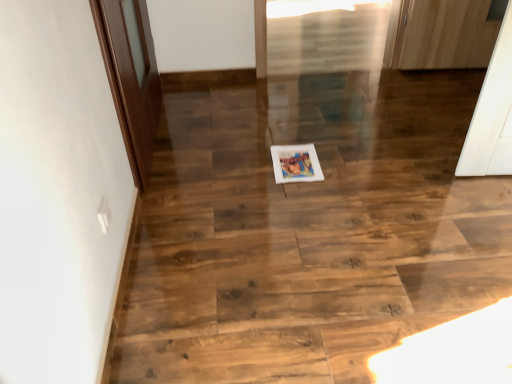
In order to click on brown wooden door at left in this screenshot , I will do `click(131, 77)`.

This screenshot has height=384, width=512. Describe the element at coordinates (131, 77) in the screenshot. I see `brown wooden door at left` at that location.

This screenshot has width=512, height=384. What are the coordinates of `matte paper postcard at center` in the screenshot? It's located at (296, 163).

This screenshot has width=512, height=384. I want to click on brown wooden door at left, so click(x=131, y=77).

Measure the distance from brown wooden door at left to matte paper postcard at center.

A distance of 27.57 inches exists between brown wooden door at left and matte paper postcard at center.

From the image's perspective, which is below, brown wooden door at left or matte paper postcard at center?

matte paper postcard at center, from the image's perspective.

From the picture: Is brown wooden door at left aimed at matte paper postcard at center?

Yes, brown wooden door at left is turned towards matte paper postcard at center.

Considering the positions of point (144, 84) and point (308, 169), is point (144, 84) closer or farther from the camera than point (308, 169)?

Clearly, point (144, 84) is more distant from the camera than point (308, 169).

Image resolution: width=512 pixels, height=384 pixels. I want to click on stairwell lying in front of the brown wooden door at left, so coord(308,229).

Is wooden floor at center positioned before brown wooden door at left?

Yes.

Which is in front, point (323, 255) or point (132, 34)?

The point (323, 255) is in front.

Is matte paper postcard at center oriented away from wooden floor at center?

No.

Considering the sizes of objects matte paper postcard at center and wooden floor at center in the image provided, who is wider, matte paper postcard at center or wooden floor at center?

Wider between the two is wooden floor at center.

From a real-world perspective, does matte paper postcard at center stand above wooden floor at center?

Correct, in the physical world, matte paper postcard at center is higher than wooden floor at center.

Would you say matte paper postcard at center is a long distance from wooden floor at center?

No.

What's the angular difference between matte paper postcard at center and brown wooden door at left's facing directions?

There is a 93.5-degree angle between the facing directions of matte paper postcard at center and brown wooden door at left.

From the image's perspective, relative to brown wooden door at left, is matte paper postcard at center above or below?

From the image's perspective, matte paper postcard at center appears below brown wooden door at left.

What are the coordinates of `postcard located behind the brown wooden door at left` in the screenshot? It's located at (296, 163).

Is matte paper postcard at center directly adjacent to brown wooden door at left?

matte paper postcard at center and brown wooden door at left are clearly separated.

From a real-world perspective, who is located higher, wooden floor at center or matte paper postcard at center?

From a 3D spatial view, matte paper postcard at center is above.

Between wooden floor at center and matte paper postcard at center, which one has larger size?

With larger size is wooden floor at center.

Does point (188, 348) appear closer or farther from the camera than point (282, 148)?

Point (188, 348) appears to be closer to the viewer than point (282, 148).

What's the angular difference between wooden floor at center and matte paper postcard at center's facing directions?

86.3 degrees.

Does point (110, 17) appear closer or farther from the camera than point (471, 309)?

Point (110, 17) appears to be farther away from the viewer than point (471, 309).

Could you tell me if brown wooden door at left is turned towards wooden floor at center?

No, brown wooden door at left is not turned towards wooden floor at center.

Is brown wooden door at left bigger or smaller than wooden floor at center?

Considering their sizes, brown wooden door at left takes up more space than wooden floor at center.

Find the location of a particular element. The height and width of the screenshot is (384, 512). postcard located below the brown wooden door at left (from the image's perspective) is located at coordinates (296, 163).

Find the location of a particular element. The height and width of the screenshot is (384, 512). stairwell in front of the brown wooden door at left is located at coordinates (308, 229).

Looking at the image, which one is located closer to wooden floor at center, matte paper postcard at center or brown wooden door at left?

matte paper postcard at center is closer to wooden floor at center.

Considering their positions, is brown wooden door at left positioned further to matte paper postcard at center than wooden floor at center?

The object further to matte paper postcard at center is brown wooden door at left.

Based on their spatial positions, is wooden floor at center or matte paper postcard at center closer to brown wooden door at left?

Based on the image, wooden floor at center appears to be nearer to brown wooden door at left.

Which object lies nearer to the anchor point wooden floor at center, brown wooden door at left or matte paper postcard at center?

The object closer to wooden floor at center is matte paper postcard at center.

Based on their spatial positions, is wooden floor at center or brown wooden door at left further from matte paper postcard at center?

The object further to matte paper postcard at center is brown wooden door at left.

Based on their spatial positions, is matte paper postcard at center or wooden floor at center further from brown wooden door at left?

Among the two, matte paper postcard at center is located further to brown wooden door at left.

The image size is (512, 384). In order to click on postcard between brown wooden door at left and wooden floor at center from left to right in this screenshot , I will do `click(296, 163)`.